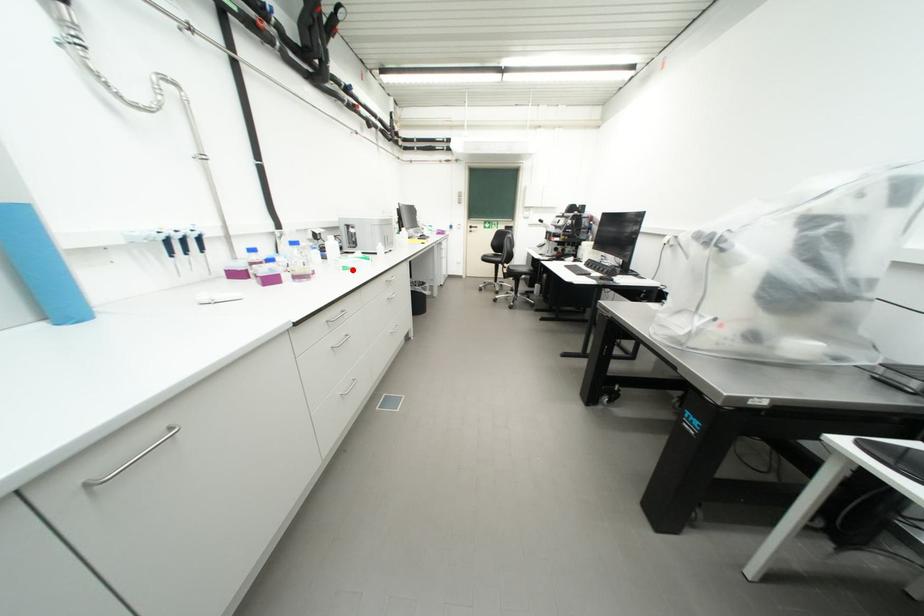
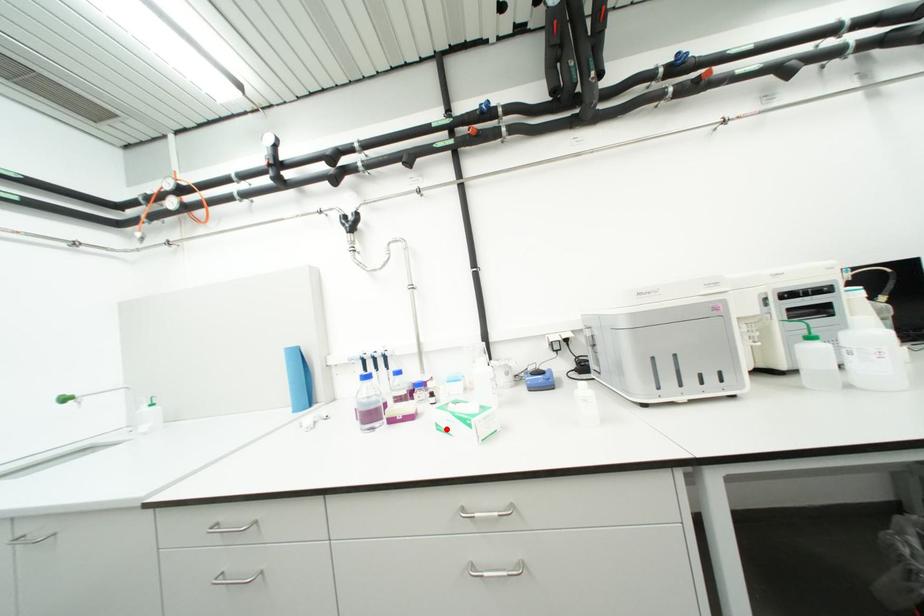
I am providing you with two images of the same scene from different viewpoints. A red point is marked on the first image and another point is marked on the second image. Does the point marked in image1 correspond to the same location as the one in image2?

Yes